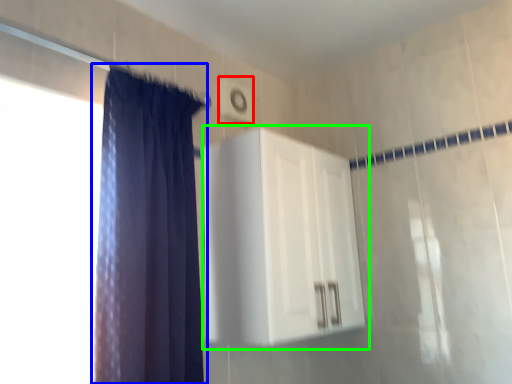
Question: Estimate the real-world distances between objects in this image. Which object is closer to light switch (highlighted by a red box), curtain (highlighted by a blue box) or dresser (highlighted by a green box)?

Choices:
 (A) curtain
 (B) dresser

Answer: (B)